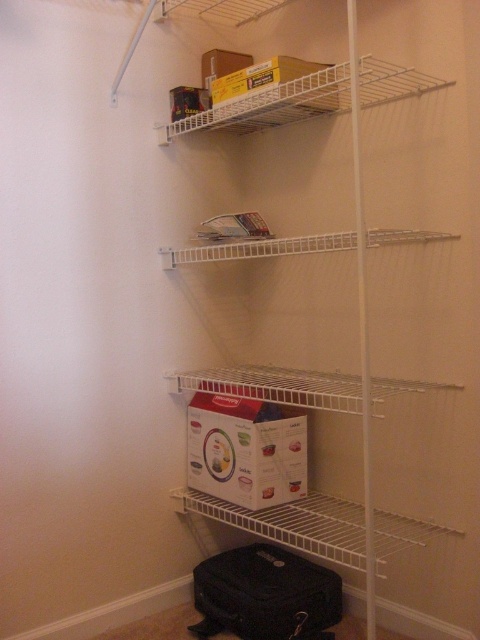
You are a delivery person holding a package that is 1.5 meters long. You need to place it on the white wire shelf at lower center. Can you fit it on the shelf without bending or damaging the package?

The distance between the white wire shelf at lower center and the viewer is 1.43 meters. Since the package is 1.5 meters long, it cannot be placed on the shelf without bending or damaging it as it exceeds the available space.